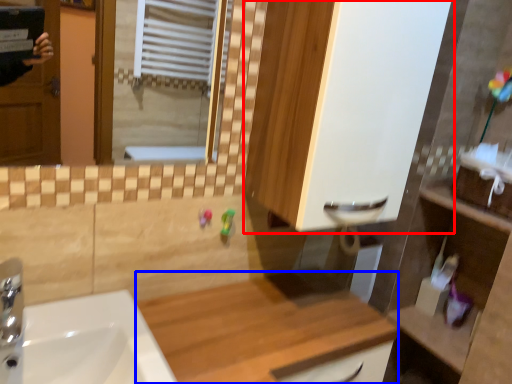
Question: Which object is further to the camera taking this photo, cabinetry (highlighted by a red box) or counter top (highlighted by a blue box)?

Choices:
 (A) cabinetry
 (B) counter top

Answer: (A)